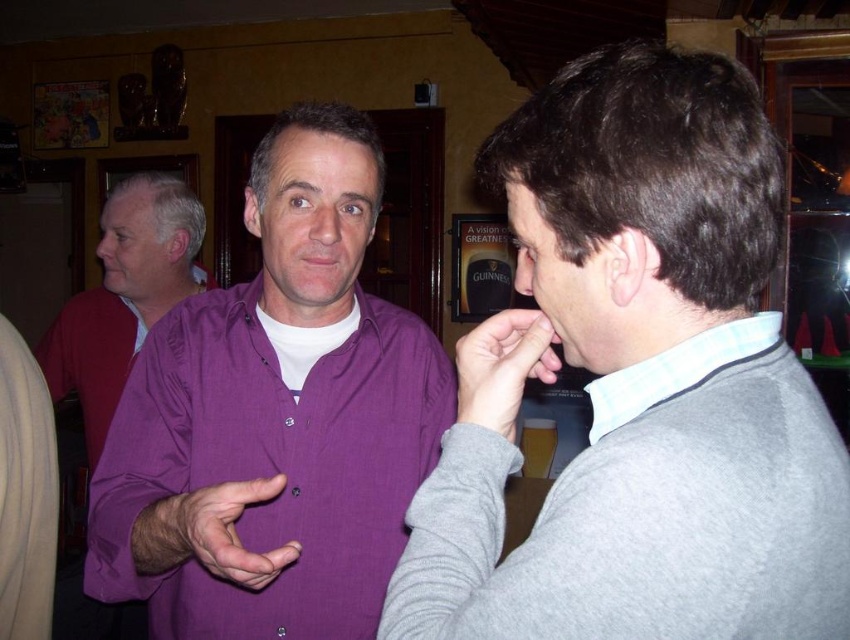
Does purple satin shirt at center have a greater width compared to matte gray sweater at center?

Indeed, purple satin shirt at center has a greater width compared to matte gray sweater at center.

Can you confirm if purple satin shirt at center is positioned to the right of matte gray sweater at center?

Incorrect, purple satin shirt at center is not on the right side of matte gray sweater at center.

Does point (95, 632) come closer to viewer compared to point (496, 326)?

No, it is behind (496, 326).

This screenshot has width=850, height=640. I want to click on purple satin shirt at center, so click(x=123, y=296).

The width and height of the screenshot is (850, 640). I want to click on purple cotton shirt at center, so click(275, 419).

Can you confirm if purple cotton shirt at center is shorter than white textured shirt at center?

In fact, purple cotton shirt at center may be taller than white textured shirt at center.

Where is `purple cotton shirt at center`? This screenshot has height=640, width=850. purple cotton shirt at center is located at coordinates (275, 419).

Identify the location of gray sweater at right. (644, 384).

How distant is gray sweater at right from purple matte shirt at center?

gray sweater at right is 12.96 inches away from purple matte shirt at center.

Where is `gray sweater at right`? gray sweater at right is located at coordinates (644, 384).

The height and width of the screenshot is (640, 850). I want to click on gray sweater at right, so click(x=644, y=384).